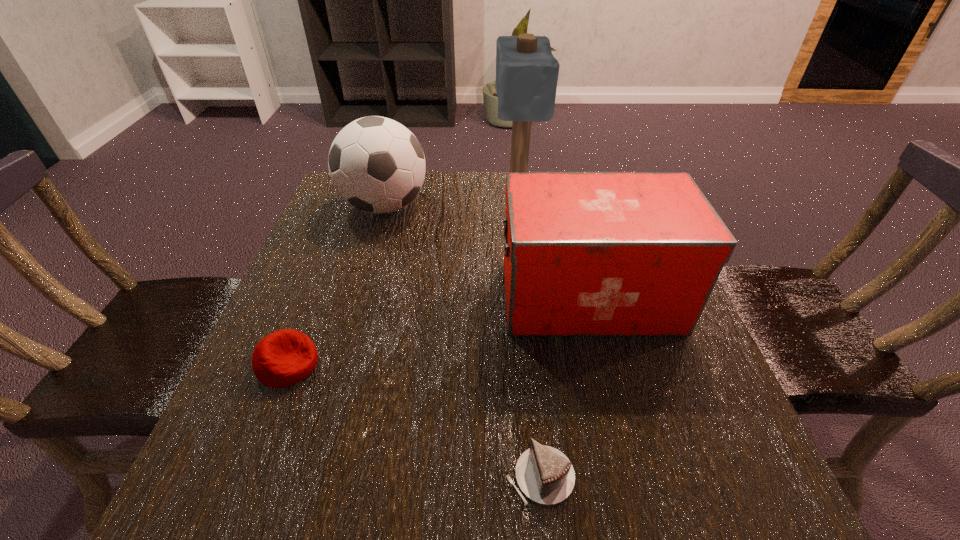
Where is `vacant area located on the handle side of the first-aid kit`? The width and height of the screenshot is (960, 540). vacant area located on the handle side of the first-aid kit is located at coordinates (386, 297).

The height and width of the screenshot is (540, 960). Find the location of `free space located on the handle side of the first-aid kit`. free space located on the handle side of the first-aid kit is located at coordinates (442, 297).

I want to click on free space located 0.070m on the seat area of the fourth tallest object, so click(358, 364).

At what (x,y) coordinates should I click in order to perform the action: click on free space located on the right of the nearest object. Please return your answer as a coordinate pair (x, y). This screenshot has width=960, height=540. Looking at the image, I should click on tap(632, 476).

Image resolution: width=960 pixels, height=540 pixels. I want to click on mallet that is positioned at the far edge, so click(527, 72).

Locate an element on the screen. soccer ball positioned at the far edge is located at coordinates (377, 165).

Where is `object present at the near edge`? Image resolution: width=960 pixels, height=540 pixels. object present at the near edge is located at coordinates (545, 475).

You are a GUI agent. You are given a task and a screenshot of the screen. Output one action in this format:
    pyautogui.click(x=<x>, y=<y>)
    Task: Click on the soccer ball that is at the left edge
    The image size is (960, 540).
    Given the screenshot: What is the action you would take?
    pyautogui.click(x=377, y=165)

Image resolution: width=960 pixels, height=540 pixels. I want to click on beanbag present at the left edge, so click(283, 358).

The image size is (960, 540). I want to click on object situated at the right edge, so click(x=585, y=254).